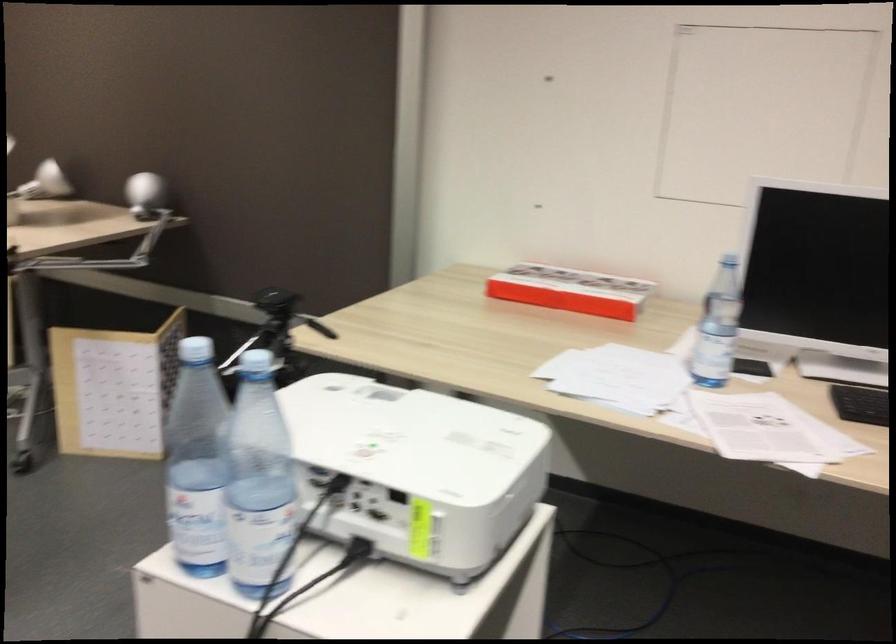
Identify the location of tripod adjustment handle. (321, 328).